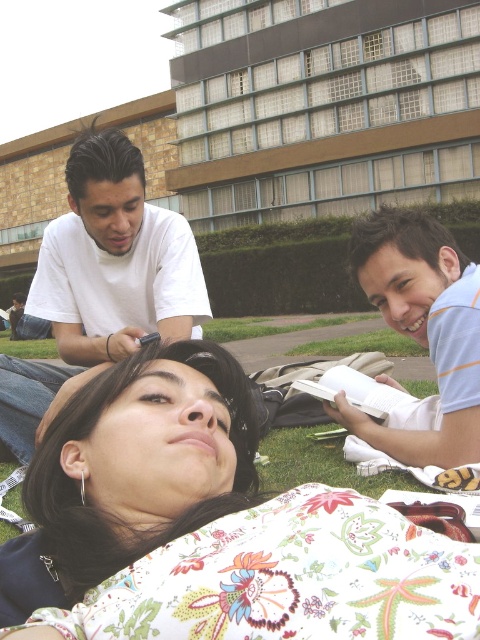
Question: Among these points, which one is nearest to the camera?

Choices:
 (A) (410, 268)
 (B) (350, 602)
 (C) (107, 445)

Answer: (B)

Question: Does floral cotton blanket at lower center have a lesser width compared to white matte shirt at upper left?

Choices:
 (A) no
 (B) yes

Answer: (B)

Question: Which object appears farthest from the camera in this image?

Choices:
 (A) floral cotton blanket at lower center
 (B) floral fabric pillow at lower center
 (C) white matte shirt at upper left
 (D) light blue striped shirt at lower right

Answer: (C)

Question: Which of these objects is positioned farthest from the floral cotton blanket at lower center?

Choices:
 (A) floral fabric pillow at lower center
 (B) light blue striped shirt at lower right

Answer: (B)

Question: Does floral cotton blanket at lower center come behind floral fabric pillow at lower center?

Choices:
 (A) yes
 (B) no

Answer: (B)

Question: Where is white matte shirt at upper left located in relation to floral fabric pillow at lower center in the image?

Choices:
 (A) right
 (B) left

Answer: (B)